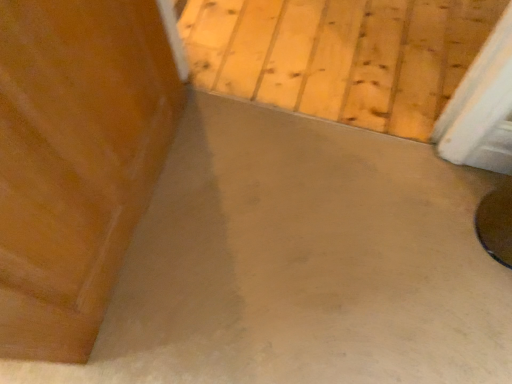
What is the approximate height of smooth concrete floor at center?

It is 1.37 inches.

What do you see at coordinates (340, 55) in the screenshot?
I see `smooth concrete floor at center` at bounding box center [340, 55].

Where is `smooth concrete floor at center`? This screenshot has height=384, width=512. smooth concrete floor at center is located at coordinates (340, 55).

The height and width of the screenshot is (384, 512). Describe the element at coordinates (496, 222) in the screenshot. I see `shiny brown table at lower right` at that location.

You are a GUI agent. You are given a task and a screenshot of the screen. Output one action in this format:
    pyautogui.click(x=<x>, y=<y>)
    Task: Click on the shiny brown table at lower right
    The height and width of the screenshot is (384, 512).
    Given the screenshot: What is the action you would take?
    pyautogui.click(x=496, y=222)

Find the location of a particular element. Image resolution: width=512 pixels, height=384 pixels. smooth concrete floor at center is located at coordinates (340, 55).

Considering the relative positions of smooth concrete floor at center and shiny brown table at lower right in the image provided, is smooth concrete floor at center to the left of shiny brown table at lower right from the viewer's perspective?

Correct, you'll find smooth concrete floor at center to the left of shiny brown table at lower right.

Consider the image. Considering their positions, is smooth concrete floor at center located in front of or behind shiny brown table at lower right?

Visually, smooth concrete floor at center is located behind shiny brown table at lower right.

Which point is more forward, (262, 31) or (508, 188)?

The point (508, 188) is closer.

From the image's perspective, which is above, smooth concrete floor at center or shiny brown table at lower right?

smooth concrete floor at center is shown above in the image.

From a real-world perspective, does smooth concrete floor at center stand above shiny brown table at lower right?

Actually, smooth concrete floor at center is physically below shiny brown table at lower right in the real world.

Can you confirm if smooth concrete floor at center is wider than shiny brown table at lower right?

Yes, smooth concrete floor at center is wider than shiny brown table at lower right.

Between smooth concrete floor at center and shiny brown table at lower right, which one has more height?

shiny brown table at lower right is taller.

Looking at this image, can you confirm if smooth concrete floor at center is bigger than shiny brown table at lower right?

Yes, smooth concrete floor at center is bigger than shiny brown table at lower right.

Is smooth concrete floor at center inside the boundaries of shiny brown table at lower right, or outside?

The correct answer is: outside.

Are smooth concrete floor at center and shiny brown table at lower right making contact?

smooth concrete floor at center is not next to shiny brown table at lower right, and they're not touching.

Is smooth concrete floor at center oriented towards shiny brown table at lower right?

No, smooth concrete floor at center is not turned towards shiny brown table at lower right.

Find the location of a particular element. The height and width of the screenshot is (384, 512). concrete lying behind the shiny brown table at lower right is located at coordinates (340, 55).

Which is more to the left, shiny brown table at lower right or smooth concrete floor at center?

Positioned to the left is smooth concrete floor at center.

Between shiny brown table at lower right and smooth concrete floor at center, which one is positioned behind?

smooth concrete floor at center is behind.

Which point is more distant from viewer, (489, 205) or (364, 75)?

The point (364, 75) is behind.

From the image's perspective, which is below, shiny brown table at lower right or smooth concrete floor at center?

shiny brown table at lower right appears lower in the image.

From a real-world perspective, does shiny brown table at lower right stand above smooth concrete floor at center?

Yes, from a real-world perspective, shiny brown table at lower right is above smooth concrete floor at center.

Considering the sizes of shiny brown table at lower right and smooth concrete floor at center in the image, is shiny brown table at lower right wider or thinner than smooth concrete floor at center?

shiny brown table at lower right is thinner than smooth concrete floor at center.

Who is taller, shiny brown table at lower right or smooth concrete floor at center?

With more height is shiny brown table at lower right.

Who is bigger, shiny brown table at lower right or smooth concrete floor at center?

smooth concrete floor at center is bigger.

Based on the photo, do you think shiny brown table at lower right is within smooth concrete floor at center, or outside of it?

shiny brown table at lower right is not inside smooth concrete floor at center, it's outside.

Is shiny brown table at lower right far from smooth concrete floor at center?

Actually, shiny brown table at lower right and smooth concrete floor at center are a little close together.

Is shiny brown table at lower right oriented away from smooth concrete floor at center?

shiny brown table at lower right does not have its back to smooth concrete floor at center.

The image size is (512, 384). I want to click on concrete on the left side of shiny brown table at lower right, so pos(340,55).

Identify the location of concrete on the left side of shiny brown table at lower right. (340, 55).

I want to click on concrete below the shiny brown table at lower right (from a real-world perspective), so click(340, 55).